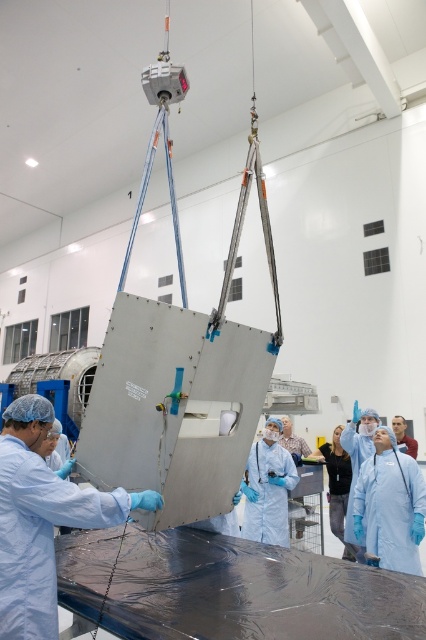
Question: Which of the following is the farthest from the observer?

Choices:
 (A) matte silver panel at center
 (B) gray matte panel at center

Answer: (B)

Question: Does gray matte panel at center have a smaller size compared to matte silver panel at center?

Choices:
 (A) no
 (B) yes

Answer: (A)

Question: Can you confirm if gray matte panel at center is bigger than matte silver panel at center?

Choices:
 (A) yes
 (B) no

Answer: (A)

Question: Which point appears closest to the camera in this image?

Choices:
 (A) (9, 500)
 (B) (247, 401)

Answer: (A)

Question: Can you confirm if gray matte panel at center is positioned to the left of matte silver panel at center?

Choices:
 (A) no
 (B) yes

Answer: (A)

Question: Which object appears closest to the camera in this image?

Choices:
 (A) matte silver panel at center
 (B) gray matte panel at center

Answer: (A)